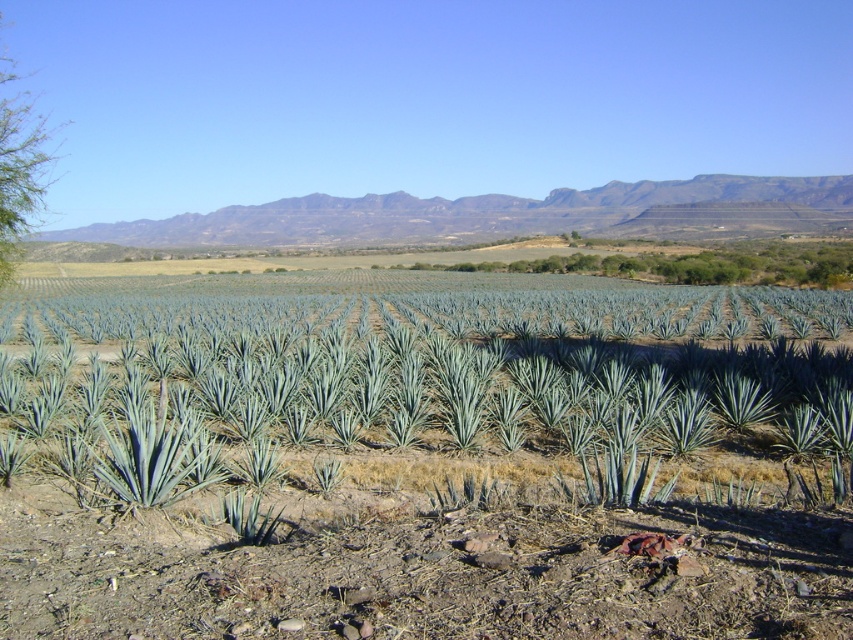
You are standing in the agricultural landscape and want to walk from the point closer to you to the point further away. Which path would you take between the two points, point (503, 268) and point (12, 80)?

You should walk from point (503, 268) to point (12, 80) because point (503, 268) is closer to the viewer and the other point is further away.

You are a farmer standing at the point marked by the coordinates point (x=694, y=264) in the image. You want to walk towards the nearest agave plant. Which direction should you head?

The point (x=694, y=264) is located at the green leafy tree at center, so you should head towards the agave plants in the foreground, which are in front of the tree, to reach the nearest agave plant.